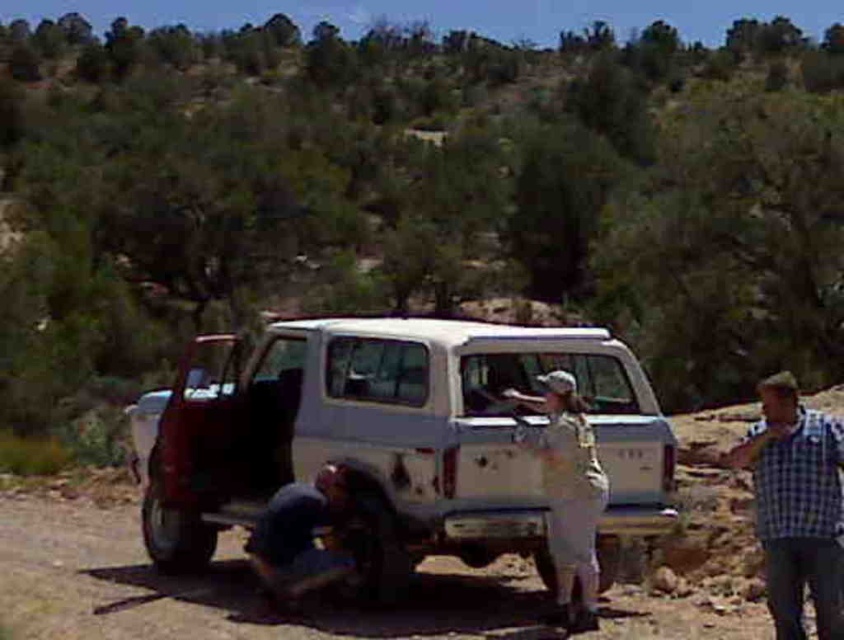
Between point (707, 625) and point (334, 497), which one is positioned behind?

The point (707, 625) is behind.

Between dirt field at lower center and blue fabric squat at lower center, which one has more height?

With more height is dirt field at lower center.

Is point (63, 577) farther from viewer compared to point (334, 504)?

Yes, it is behind point (334, 504).

Locate an element on the screen. This screenshot has width=844, height=640. dirt field at lower center is located at coordinates (198, 580).

Is white matte jeep at center further to the viewer compared to dirt field at lower center?

Yes, it is.

Does point (214, 515) come in front of point (123, 616)?

That is False.

What do you see at coordinates (398, 442) in the screenshot? This screenshot has width=844, height=640. I see `white matte jeep at center` at bounding box center [398, 442].

At what (x,y) coordinates should I click in order to perform the action: click on white matte jeep at center. Please return your answer as a coordinate pair (x, y). Looking at the image, I should click on (398, 442).

Is white matte jeep at center below blue fabric squat at lower center?

No.

Who is positioned more to the left, white matte jeep at center or blue fabric squat at lower center?

blue fabric squat at lower center

Find the location of a particular element. white matte jeep at center is located at coordinates (398, 442).

The height and width of the screenshot is (640, 844). I want to click on white matte jeep at center, so tap(398, 442).